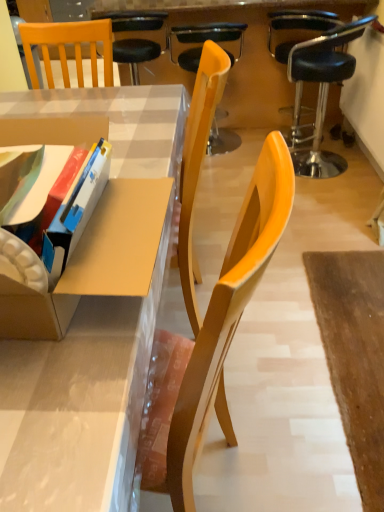
Question: Considering the relative sizes of wooden chair at center, which is the second chair in left-to-right order, and matte plastic desk at center in the image provided, is wooden chair at center, which is the second chair in left-to-right order, shorter than matte plastic desk at center?

Choices:
 (A) yes
 (B) no

Answer: (B)

Question: Could matte plastic desk at center be considered to be inside wooden chair at center, which is the second chair in left-to-right order?

Choices:
 (A) yes
 (B) no

Answer: (B)

Question: Is wooden chair at center, which is the second chair in left-to-right order, at the left side of matte plastic desk at center?

Choices:
 (A) no
 (B) yes

Answer: (A)

Question: Is wooden chair at center, which is the second chair in left-to-right order, taller than matte plastic desk at center?

Choices:
 (A) no
 (B) yes

Answer: (B)

Question: Does wooden chair at center, the 2th chair positioned from the right, have a greater width compared to matte plastic desk at center?

Choices:
 (A) no
 (B) yes

Answer: (A)

Question: Is wooden chair at center, the 2th chair positioned from the right, inside or outside of black leather stool at upper right, the third chair viewed from the left?

Choices:
 (A) outside
 (B) inside

Answer: (A)

Question: In terms of height, does wooden chair at center, the 2th chair positioned from the right, look taller or shorter compared to black leather stool at upper right, the third chair viewed from the left?

Choices:
 (A) tall
 (B) short

Answer: (B)

Question: From the image's perspective, is wooden chair at center, the 2th chair positioned from the right, positioned above or below black leather stool at upper right, the third chair viewed from the left?

Choices:
 (A) above
 (B) below

Answer: (A)

Question: Is wooden chair at center, which is the second chair in left-to-right order, to the left or to the right of black leather stool at upper right, the third chair viewed from the left, in the image?

Choices:
 (A) right
 (B) left

Answer: (B)

Question: Do you think matte plastic desk at center is within wooden chair at upper left, the first chair viewed from the left, or outside of it?

Choices:
 (A) outside
 (B) inside

Answer: (A)

Question: Is matte plastic desk at center taller or shorter than wooden chair at upper left, the first chair viewed from the left?

Choices:
 (A) tall
 (B) short

Answer: (A)

Question: From the image's perspective, is matte plastic desk at center positioned above or below wooden chair at upper left, the 3th chair when ordered from right to left?

Choices:
 (A) below
 (B) above

Answer: (A)

Question: Is point (34, 477) closer or farther from the camera than point (114, 52)?

Choices:
 (A) farther
 (B) closer

Answer: (B)

Question: In terms of height, does matte plastic desk at center look taller or shorter compared to cardboard box at left?

Choices:
 (A) short
 (B) tall

Answer: (A)

Question: From the image's perspective, relative to cardboard box at left, is matte plastic desk at center above or below?

Choices:
 (A) below
 (B) above

Answer: (A)